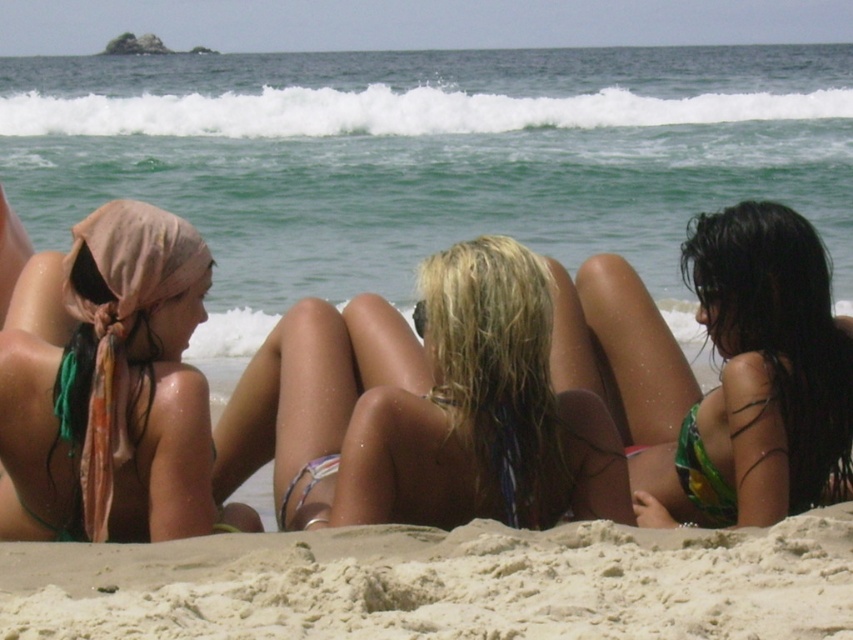
Between multicolored bikini at center and multicolored fabric bikini at center, which one is positioned lower?

multicolored fabric bikini at center is lower down.

Does multicolored bikini at center appear under multicolored fabric bikini at center?

No, multicolored bikini at center is not below multicolored fabric bikini at center.

Which is in front, point (540, 433) or point (285, 508)?

Positioned in front is point (540, 433).

Locate an element on the screen. Image resolution: width=853 pixels, height=640 pixels. multicolored bikini at center is located at coordinates (473, 404).

Which is more to the left, fine-grained sand at lower center or multicolored bikini at center?

fine-grained sand at lower center is more to the left.

Does fine-grained sand at lower center come in front of multicolored bikini at center?

Yes, it is in front of multicolored bikini at center.

The height and width of the screenshot is (640, 853). What do you see at coordinates (444, 584) in the screenshot?
I see `fine-grained sand at lower center` at bounding box center [444, 584].

Locate an element on the screen. The image size is (853, 640). fine-grained sand at lower center is located at coordinates (444, 584).

Does matte pink headscarf at left have a greater width compared to multicolored bikini at center?

In fact, matte pink headscarf at left might be narrower than multicolored bikini at center.

Does matte pink headscarf at left have a lesser height compared to multicolored bikini at center?

No.

Locate an element on the screen. matte pink headscarf at left is located at coordinates [x=112, y=392].